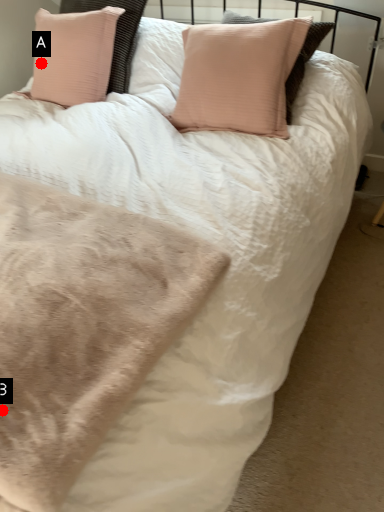
Question: Two points are circled on the image, labeled by A and B beside each circle. Which point is closer to the camera?

Choices:
 (A) A is closer
 (B) B is closer

Answer: (B)